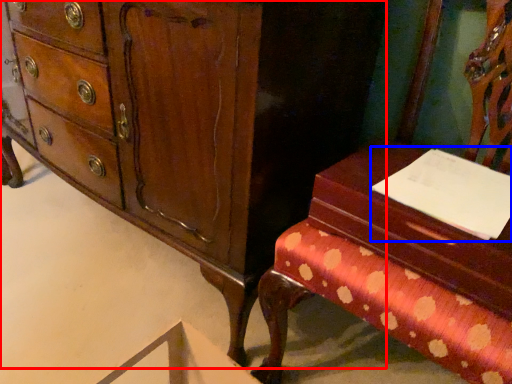
Question: Which of the following is the closest to the observer, chest of drawers (highlighted by a red box) or notepad (highlighted by a blue box)?

Choices:
 (A) chest of drawers
 (B) notepad

Answer: (A)